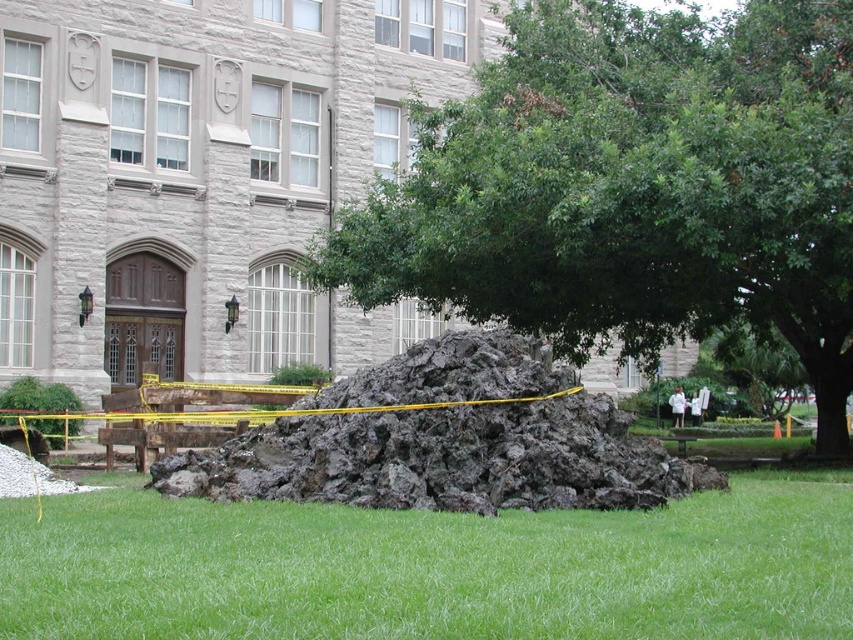
Is green leafy tree at center below green grass at lower center?

Actually, green leafy tree at center is above green grass at lower center.

Identify the location of green leafy tree at center. (633, 188).

Is point (817, 200) more distant than point (422, 584)?

Yes, point (817, 200) is farther from viewer.

The width and height of the screenshot is (853, 640). Identify the location of green leafy tree at center. (633, 188).

Does green leafy tree at center have a smaller size compared to dark gray rock at center?

No.

Does green leafy tree at center have a greater height compared to dark gray rock at center?

Indeed, green leafy tree at center has a greater height compared to dark gray rock at center.

The image size is (853, 640). What are the coordinates of `green leafy tree at center` in the screenshot? It's located at (633, 188).

The image size is (853, 640). I want to click on green leafy tree at center, so click(x=633, y=188).

Which is below, green grass at lower center or dark gray rock at center?

green grass at lower center is below.

Describe the element at coordinates (432, 566) in the screenshot. I see `green grass at lower center` at that location.

This screenshot has height=640, width=853. I want to click on green grass at lower center, so [432, 566].